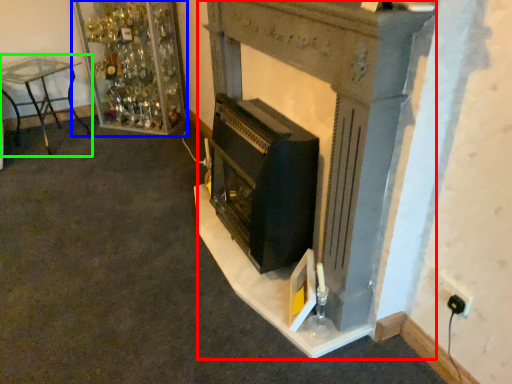
Question: Which object is positioned farthest from fireplace (highlighted by a red box)? Select from shelf (highlighted by a blue box) and furniture (highlighted by a green box).

Choices:
 (A) shelf
 (B) furniture

Answer: (B)